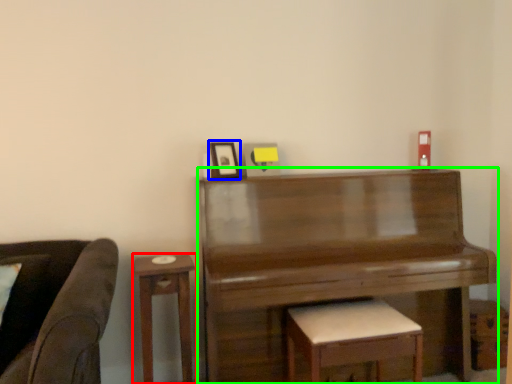
Question: Based on their relative distances, which object is farther from table (highlighted by a red box)? Choose from picture frame (highlighted by a blue box) and piano (highlighted by a green box).

Choices:
 (A) picture frame
 (B) piano

Answer: (B)